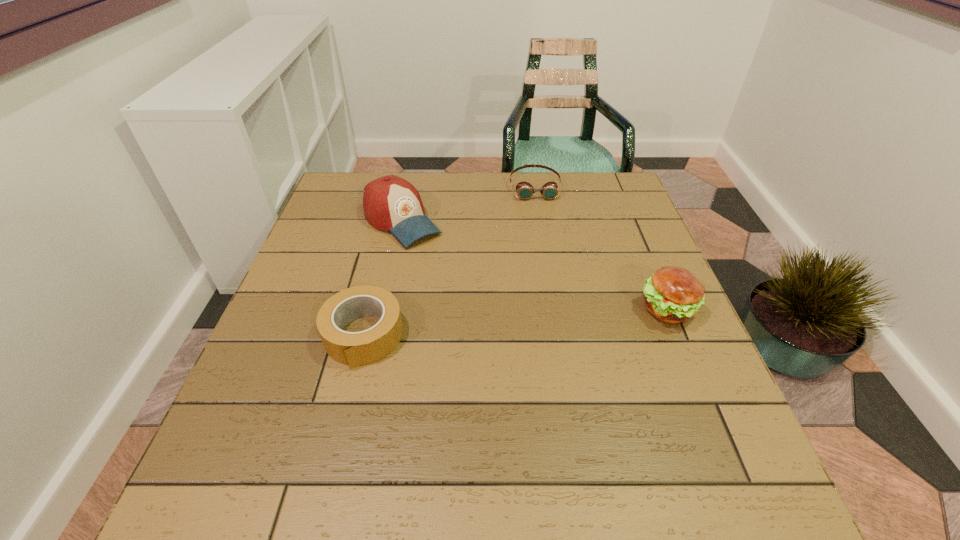
The image size is (960, 540). Find the location of `vacant region between the rightmost object and the third object from left to right`. vacant region between the rightmost object and the third object from left to right is located at coordinates (601, 248).

Locate an element on the screen. free space between the rightmost object and the second object from right to left is located at coordinates (601, 248).

Image resolution: width=960 pixels, height=540 pixels. I want to click on vacant area that lies between the shortest object and the duct tape, so click(449, 261).

Where is `vacant region between the hamburger and the goggles`? Image resolution: width=960 pixels, height=540 pixels. vacant region between the hamburger and the goggles is located at coordinates (601, 248).

Select which object appears as the second closest to the goggles. Please provide its 2D coordinates. Your answer should be formatted as a tuple, i.e. [(x, y)], where the tuple contains the x and y coordinates of a point satisfying the conditions above.

[(673, 294)]

Locate an element on the screen. The width and height of the screenshot is (960, 540). object that is the second nearest to the goggles is located at coordinates (673, 294).

Where is `vacant area that satisfies the following two spatial constraints: 1. on the front side of the hamburger; 2. on the right side of the third object from left to right`? vacant area that satisfies the following two spatial constraints: 1. on the front side of the hamburger; 2. on the right side of the third object from left to right is located at coordinates (556, 310).